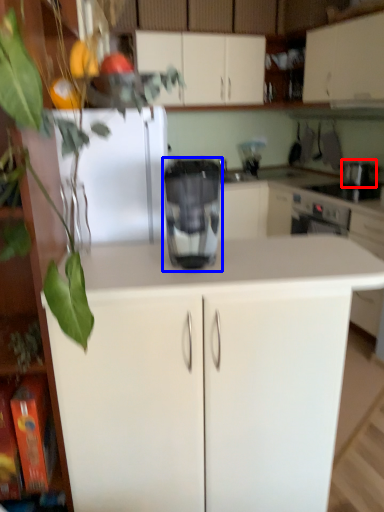
Question: Among these objects, which one is nearest to the camera, appliance (highlighted by a red box) or home appliance (highlighted by a blue box)?

Choices:
 (A) appliance
 (B) home appliance

Answer: (B)